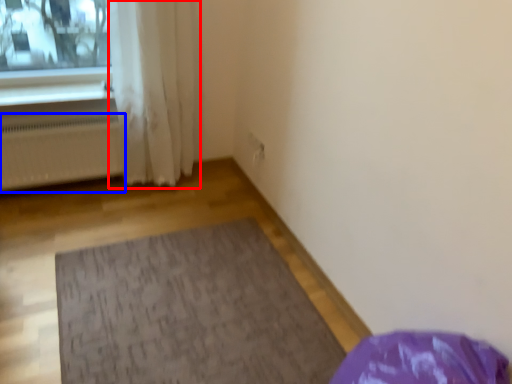
Question: Among these objects, which one is farthest to the camera, curtain (highlighted by a red box) or radiator (highlighted by a blue box)?

Choices:
 (A) curtain
 (B) radiator

Answer: (B)